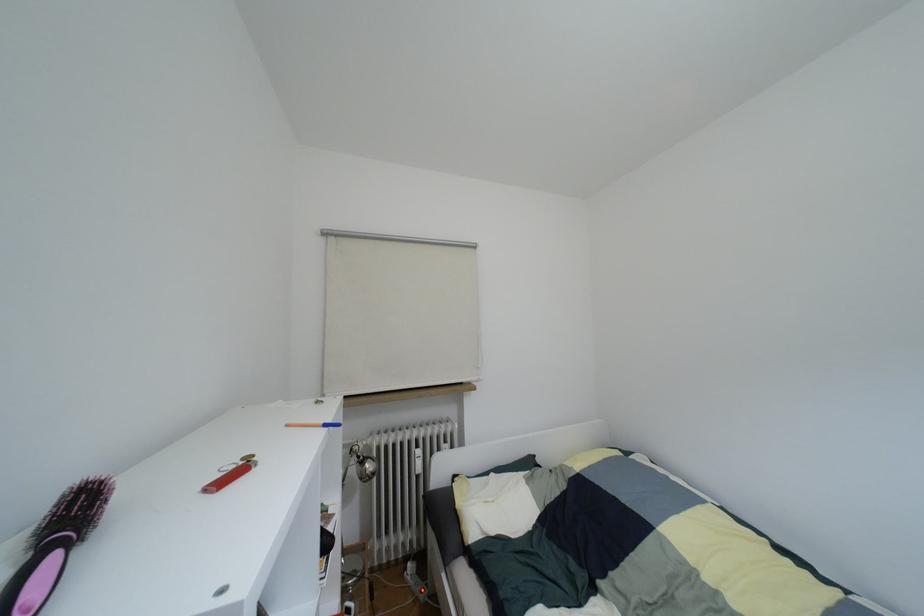
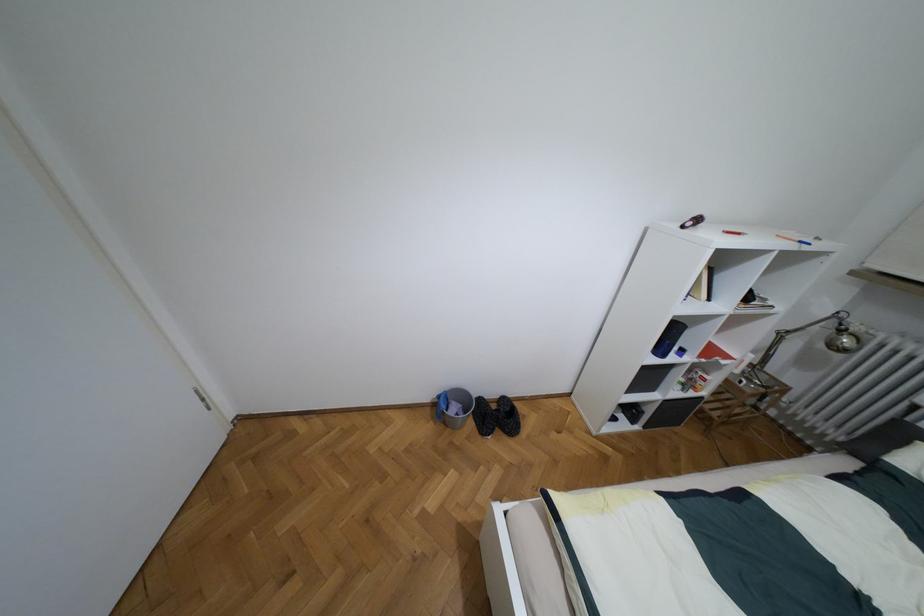
Where in the second image is the point corresponding to pixel 360 461 from the first image?

(840, 330)